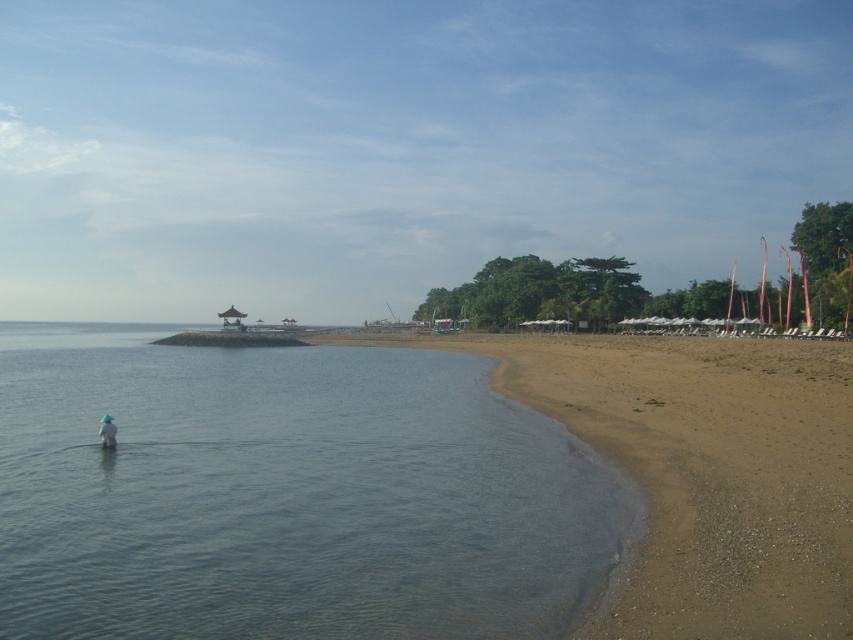
You are standing on the beach and see the clear water at lower left and the white fabric hat at lower left. Which object is closer to the bottom edge of the image?

The clear water at lower left is closer to the bottom edge of the image because it is located below the white fabric hat at lower left.

You are standing on the beach and see the clear water at lower left and the white fabric hat at lower left. Which object is closer to the left edge of the beach?

The clear water at lower left is positioned on the left side of white fabric hat at lower left, so the clear water at lower left is closer to the left edge of the beach.

You are planning to set up a small tent between the sandy beach at lower right and the white fabric hat at lower left. The tent requires a minimum of 20 meters of space. Can you determine if there is enough space between these two landmarks?

The distance between the sandy beach at lower right and the white fabric hat at lower left is 25.42 meters, which is more than the required 20 meters. Therefore, there is sufficient space to set up the tent.